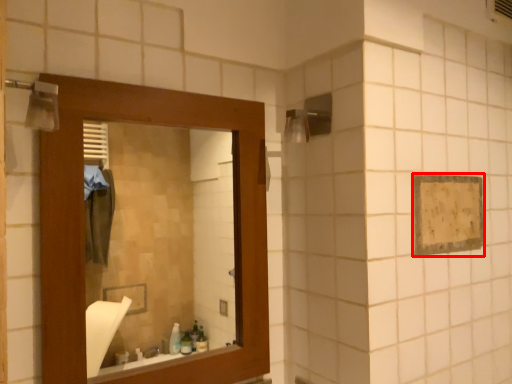
Question: Where is square (annotated by the red box) located in relation to mirror in the image?

Choices:
 (A) right
 (B) left

Answer: (A)